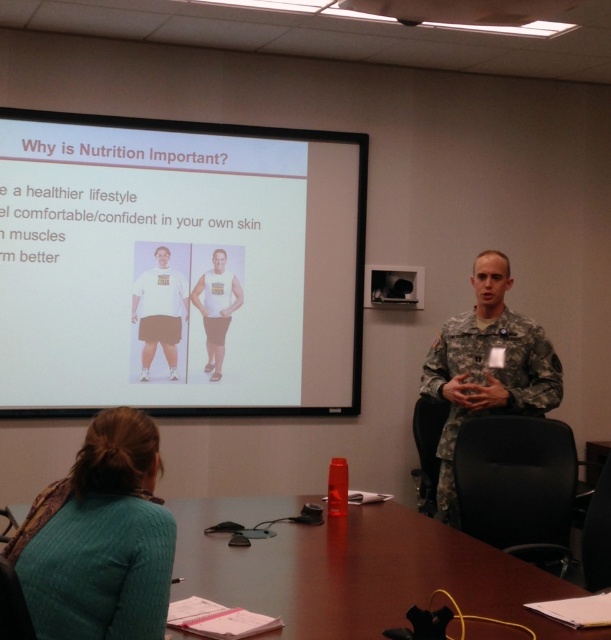
Question: Estimate the real-world distances between objects in this image. Which object is farther from the white matte t-shirt at center?

Choices:
 (A) camouflage uniform at center
 (B) teal knitted sweater at lower left
 (C) white matte tank top at center

Answer: (B)

Question: Which of the following is the farthest from the observer?

Choices:
 (A) (148, 342)
 (B) (104, 454)
 (C) (225, 320)

Answer: (C)

Question: Is teal knitted sweater at lower left behind camouflage uniform at center?

Choices:
 (A) yes
 (B) no

Answer: (B)

Question: Which point is closer to the camera?

Choices:
 (A) white matte t-shirt at center
 (B) camouflage uniform at center
 (C) white matte tank top at center

Answer: (B)

Question: Is camouflage uniform at center positioned before white matte tank top at center?

Choices:
 (A) yes
 (B) no

Answer: (A)

Question: Can you confirm if wooden table at center is positioned to the left of white matte tank top at center?

Choices:
 (A) no
 (B) yes

Answer: (A)